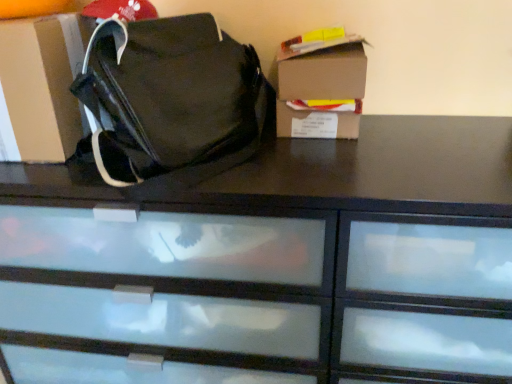
Question: Is the position of cardboard box at upper right less distant than that of cardboard box at left?

Choices:
 (A) yes
 (B) no

Answer: (B)

Question: From the image's perspective, would you say cardboard box at upper right is shown under cardboard box at left?

Choices:
 (A) no
 (B) yes

Answer: (B)

Question: Does cardboard box at upper right have a lesser width compared to cardboard box at left?

Choices:
 (A) yes
 (B) no

Answer: (A)

Question: Can you confirm if cardboard box at upper right is wider than cardboard box at left?

Choices:
 (A) yes
 (B) no

Answer: (B)

Question: Could you tell me if cardboard box at upper right is turned towards cardboard box at left?

Choices:
 (A) no
 (B) yes

Answer: (A)

Question: Are cardboard box at upper right and cardboard box at left far apart?

Choices:
 (A) no
 (B) yes

Answer: (A)

Question: Is black glossy chest of drawers at center next to cardboard box at upper right?

Choices:
 (A) yes
 (B) no

Answer: (B)

Question: Would you say cardboard box at upper right is part of black glossy chest of drawers at center's contents?

Choices:
 (A) yes
 (B) no

Answer: (B)

Question: Does black glossy chest of drawers at center have a lesser height compared to cardboard box at upper right?

Choices:
 (A) no
 (B) yes

Answer: (A)

Question: Does black glossy chest of drawers at center appear on the right side of cardboard box at upper right?

Choices:
 (A) yes
 (B) no

Answer: (B)

Question: From a real-world perspective, does black glossy chest of drawers at center stand above cardboard box at upper right?

Choices:
 (A) yes
 (B) no

Answer: (B)

Question: Is black glossy chest of drawers at center positioned before cardboard box at upper right?

Choices:
 (A) yes
 (B) no

Answer: (A)

Question: Is cardboard box at upper right further to the viewer compared to matte black bag at center?

Choices:
 (A) yes
 (B) no

Answer: (A)